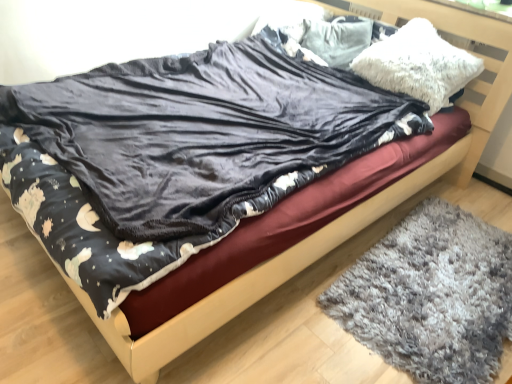
Question: Does velvet dark blue blanket at center have a greater width compared to white fluffy pillow at upper center, the 1th pillow in the back-to-front sequence?

Choices:
 (A) yes
 (B) no

Answer: (A)

Question: Is velvet dark blue blanket at center to the right of white fluffy pillow at upper center, the 1th pillow in the back-to-front sequence, from the viewer's perspective?

Choices:
 (A) no
 (B) yes

Answer: (A)

Question: Is velvet dark blue blanket at center smaller than white fluffy pillow at upper center, the 2th pillow positioned from the front?

Choices:
 (A) no
 (B) yes

Answer: (A)

Question: Does velvet dark blue blanket at center have a greater height compared to white fluffy pillow at upper center, the 1th pillow in the back-to-front sequence?

Choices:
 (A) yes
 (B) no

Answer: (B)

Question: Does velvet dark blue blanket at center turn towards white fluffy pillow at upper center, the 2th pillow positioned from the front?

Choices:
 (A) yes
 (B) no

Answer: (B)

Question: From the image's perspective, is velvet dark blue blanket at center under white fluffy pillow at upper center, the 2th pillow positioned from the front?

Choices:
 (A) yes
 (B) no

Answer: (A)

Question: Is wooden bed frame at center facing away from gray shaggy rug at lower right?

Choices:
 (A) no
 (B) yes

Answer: (A)

Question: Does wooden bed frame at center turn towards gray shaggy rug at lower right?

Choices:
 (A) no
 (B) yes

Answer: (A)

Question: From a real-world perspective, is wooden bed frame at center under gray shaggy rug at lower right?

Choices:
 (A) yes
 (B) no

Answer: (A)

Question: Considering the relative positions of wooden bed frame at center and gray shaggy rug at lower right in the image provided, is wooden bed frame at center to the left of gray shaggy rug at lower right from the viewer's perspective?

Choices:
 (A) yes
 (B) no

Answer: (A)

Question: From the image's perspective, is wooden bed frame at center located above gray shaggy rug at lower right?

Choices:
 (A) yes
 (B) no

Answer: (A)

Question: Is wooden bed frame at center thinner than gray shaggy rug at lower right?

Choices:
 (A) no
 (B) yes

Answer: (A)

Question: Is white fluffy pillow at upper center, the 2th pillow positioned from the front, positioned before velvet dark blue blanket at center?

Choices:
 (A) no
 (B) yes

Answer: (A)